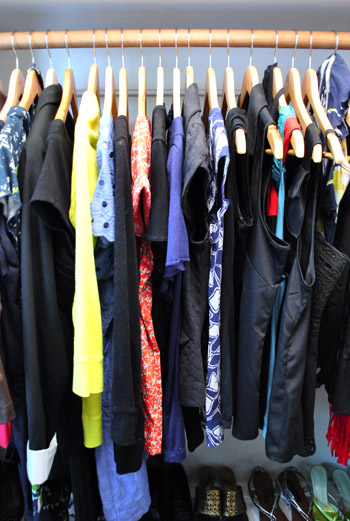
In order to click on white wall in this screenshot , I will do `click(144, 19)`.